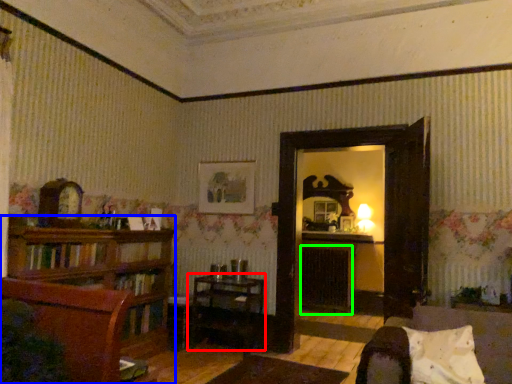
Question: Which object is positioned farthest from table (highlighted by a red box)? Select from shelf (highlighted by a blue box) and fireplace (highlighted by a green box).

Choices:
 (A) shelf
 (B) fireplace

Answer: (B)